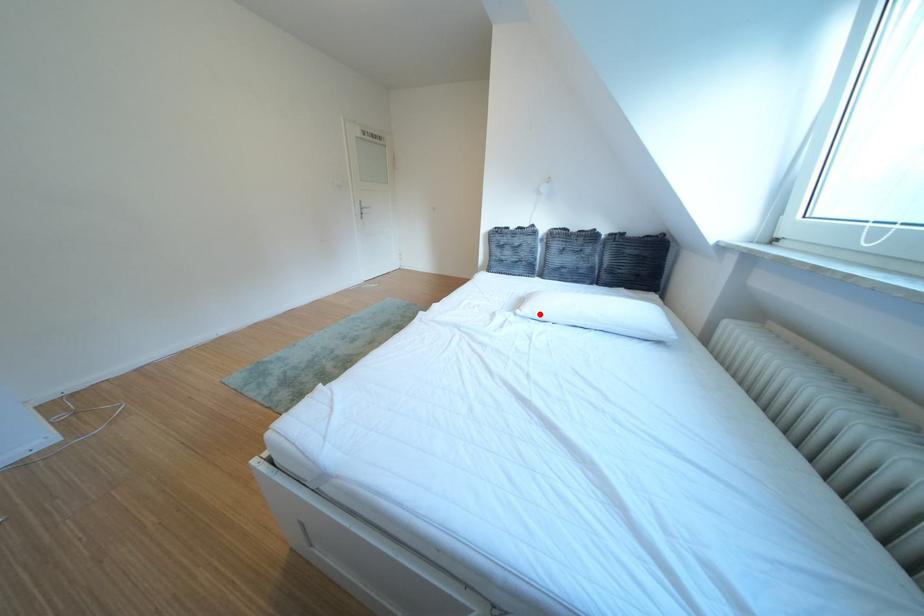
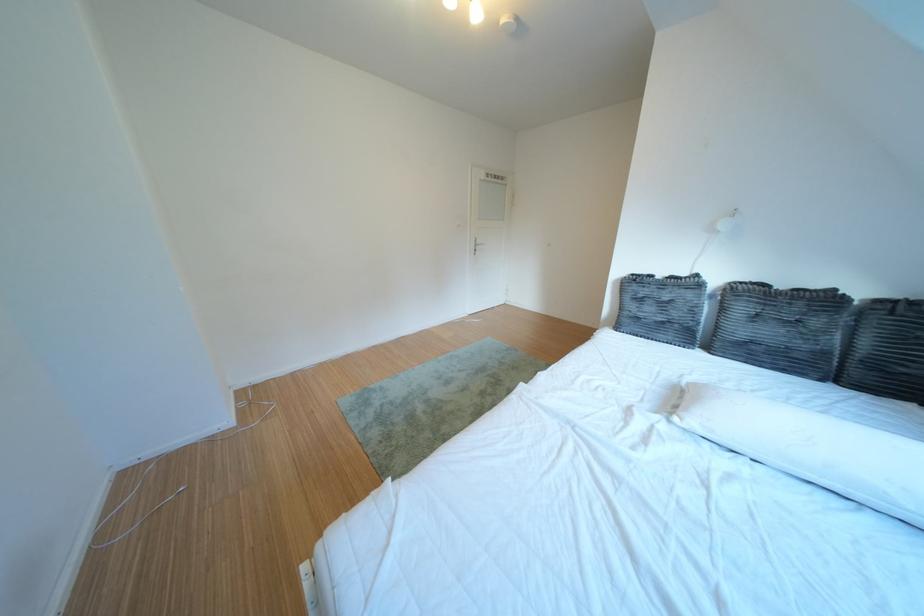
Locate, in the second image, the point that corresponds to the highlighted location in the first image.

(707, 424)